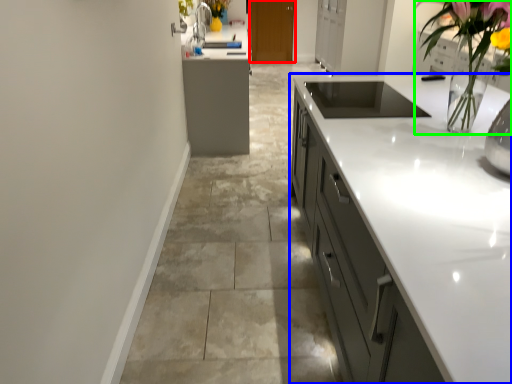
Question: Which is farther away from cabinetry (highlighted by a red box)? cabinetry (highlighted by a blue box) or floral arrangement (highlighted by a green box)?

Choices:
 (A) cabinetry
 (B) floral arrangement

Answer: (B)